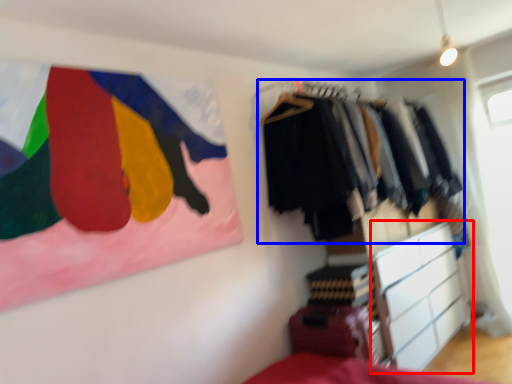
Question: Which of the following is the closest to the observer, chest of drawers (highlighted by a red box) or closet (highlighted by a blue box)?

Choices:
 (A) chest of drawers
 (B) closet

Answer: (B)